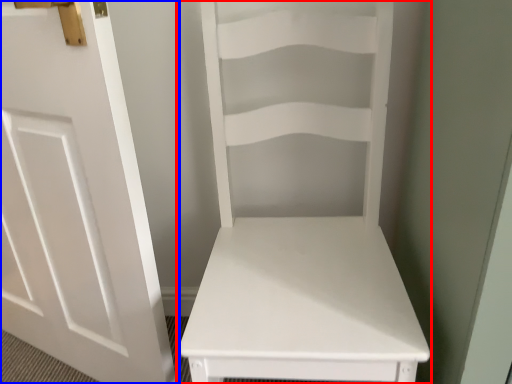
Question: Which object appears closest to the camera in this image, furniture (highlighted by a red box) or door (highlighted by a blue box)?

Choices:
 (A) furniture
 (B) door

Answer: (A)